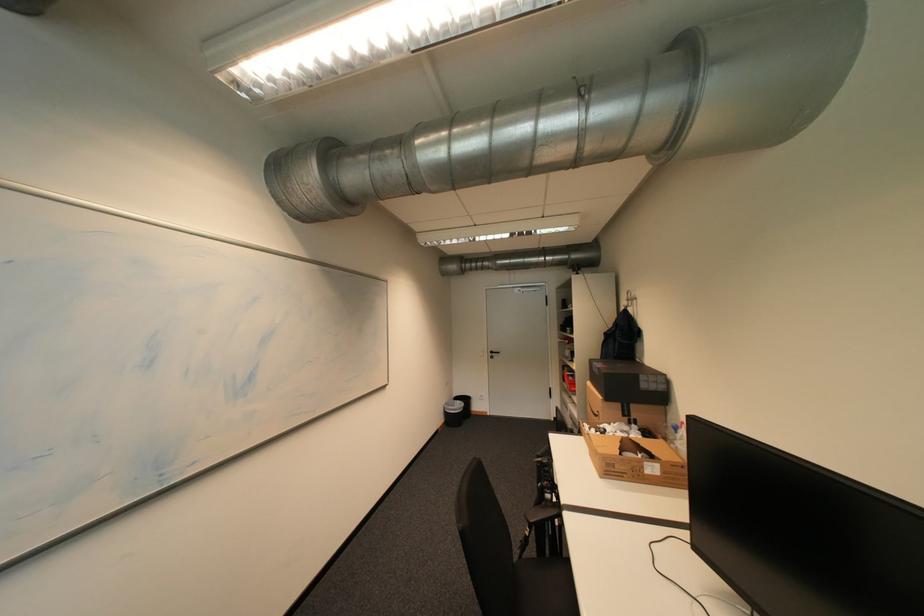
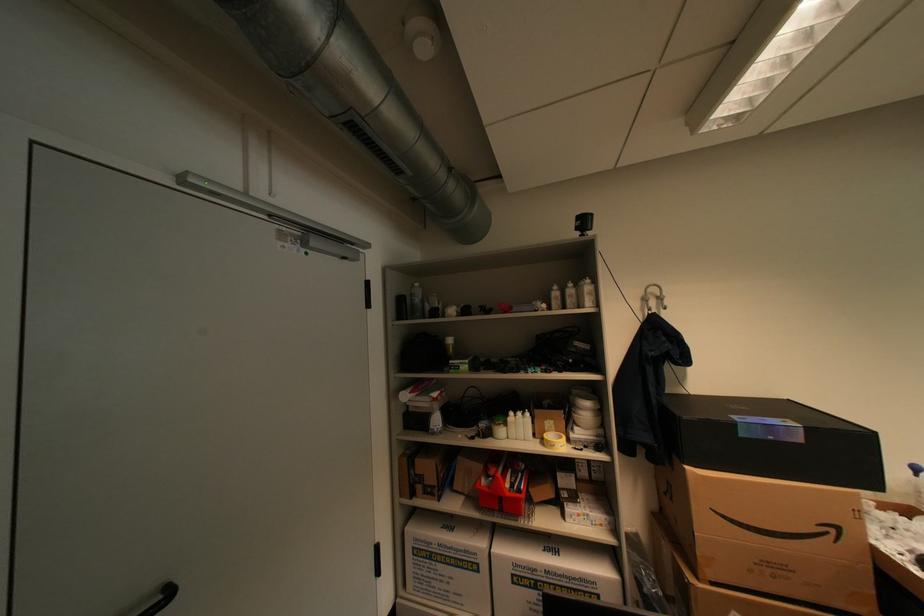
Locate, in the second image, the point that corresponds to point (573, 403) in the first image.

(439, 556)